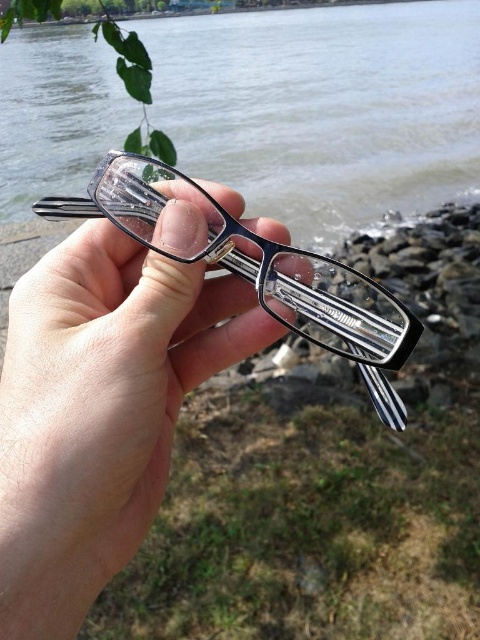
You are trying to decide which pair of glasses to wear for a hike. You see the clear plastic glasses at center and the matte black glasses at center. Which one is positioned to the left?

The clear plastic glasses at center is to the left of matte black glasses at center, so the clear plastic glasses at center is positioned to the left.

You are trying to determine the position of the transparent plastic water at center and clear plastic glasses at center in the image. Which one is located to the right of the other?

The transparent plastic water at center is positioned on the right side of clear plastic glasses at center, so the water is to the right of the glasses.

From the picture: Based on the scene, if you were to place the clear plastic glasses at center into the transparent plastic water at center, would the glasses fit entirely within the water?

The transparent plastic water at center is wider than the clear plastic glasses at center, so the glasses would fit entirely within the water.